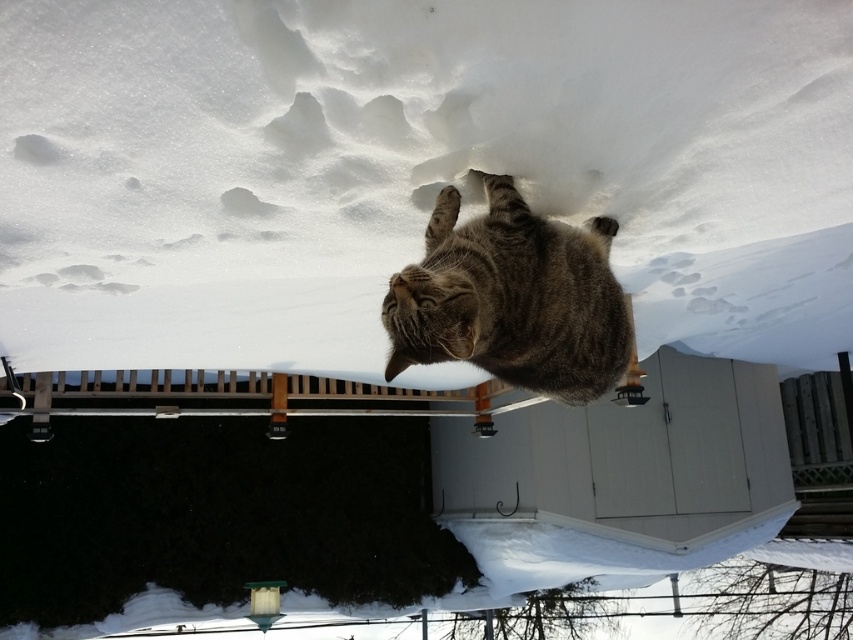
Question: Is white fluffy snow at upper center to the left of tabby fur cat at center from the viewer's perspective?

Choices:
 (A) yes
 (B) no

Answer: (A)

Question: Which point is farther to the camera?

Choices:
 (A) (624, 72)
 (B) (407, 301)

Answer: (A)

Question: Is white fluffy snow at upper center wider than tabby fur cat at center?

Choices:
 (A) no
 (B) yes

Answer: (B)

Question: Can you confirm if white fluffy snow at upper center is positioned below tabby fur cat at center?

Choices:
 (A) no
 (B) yes

Answer: (A)